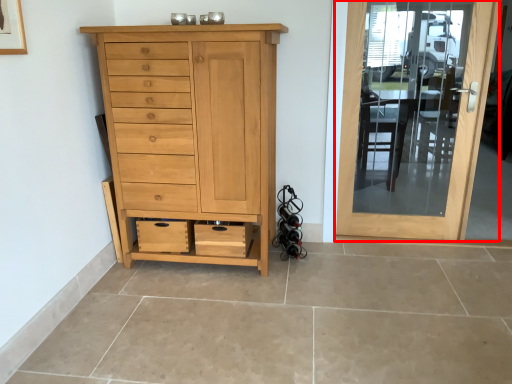
Question: From the image's perspective, considering the relative positions of door (annotated by the red box) and chest of drawers in the image provided, where is door (annotated by the red box) located with respect to the staircase?

Choices:
 (A) below
 (B) above

Answer: (B)